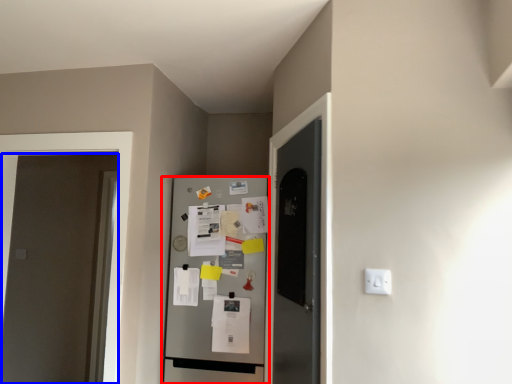
Question: Which object is closer to the camera taking this photo, refrigerator (highlighted by a red box) or door (highlighted by a blue box)?

Choices:
 (A) refrigerator
 (B) door

Answer: (B)